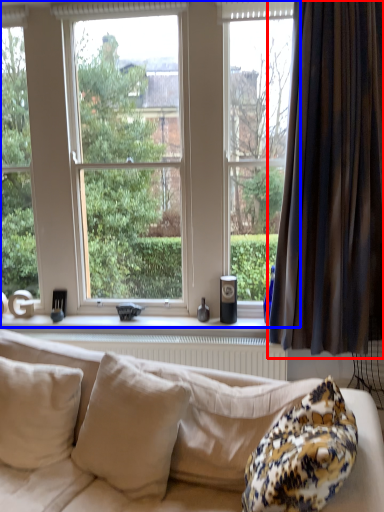
Question: Which object appears farthest to the camera in this image, curtain (highlighted by a red box) or window (highlighted by a blue box)?

Choices:
 (A) curtain
 (B) window

Answer: (B)